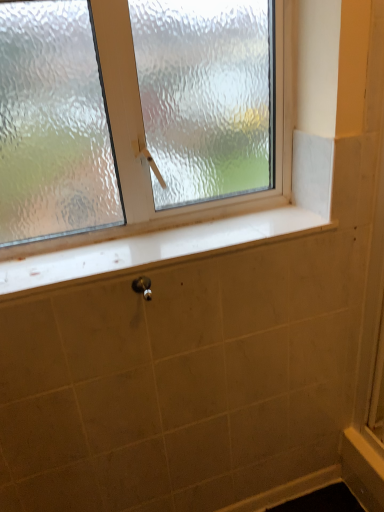
Question: Is metallic silver shower at lower center not near white glossy window sill at center?

Choices:
 (A) yes
 (B) no

Answer: (B)

Question: Does metallic silver shower at lower center have a greater width compared to white glossy window sill at center?

Choices:
 (A) yes
 (B) no

Answer: (B)

Question: Is the depth of metallic silver shower at lower center less than that of white glossy window sill at center?

Choices:
 (A) yes
 (B) no

Answer: (B)

Question: Is metallic silver shower at lower center smaller than white glossy window sill at center?

Choices:
 (A) yes
 (B) no

Answer: (A)

Question: Is metallic silver shower at lower center further to camera compared to white glossy window sill at center?

Choices:
 (A) no
 (B) yes

Answer: (B)

Question: Does point (269, 232) appear closer or farther from the camera than point (278, 47)?

Choices:
 (A) closer
 (B) farther

Answer: (A)

Question: Would you say white glossy window sill at center is to the left or to the right of frosted glass window at upper center in the picture?

Choices:
 (A) right
 (B) left

Answer: (A)

Question: From their relative heights in the image, would you say white glossy window sill at center is taller or shorter than frosted glass window at upper center?

Choices:
 (A) short
 (B) tall

Answer: (A)

Question: Is white glossy window sill at center bigger or smaller than frosted glass window at upper center?

Choices:
 (A) big
 (B) small

Answer: (B)

Question: Choose the correct answer: Is frosted glass window at upper center inside white glossy window sill at center or outside it?

Choices:
 (A) inside
 (B) outside

Answer: (B)

Question: Considering their positions, is frosted glass window at upper center located in front of or behind white glossy window sill at center?

Choices:
 (A) behind
 (B) front

Answer: (B)

Question: Is frosted glass window at upper center to the left or to the right of white glossy window sill at center in the image?

Choices:
 (A) right
 (B) left

Answer: (B)

Question: Looking at their shapes, would you say frosted glass window at upper center is wider or thinner than white glossy window sill at center?

Choices:
 (A) thin
 (B) wide

Answer: (A)

Question: From the image's perspective, is white glossy window sill at center above or below metallic silver shower at lower center?

Choices:
 (A) below
 (B) above

Answer: (B)

Question: Looking at the image, does white glossy window sill at center seem bigger or smaller compared to metallic silver shower at lower center?

Choices:
 (A) small
 (B) big

Answer: (B)